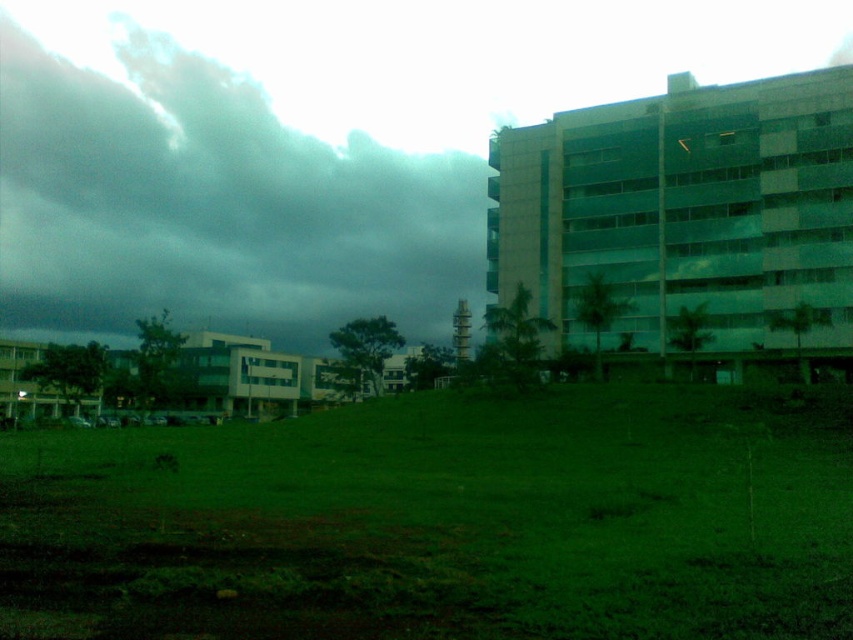
Can you confirm if green grassy field at lower center is smaller than dark gray cloud at upper left?

Yes.

Based on the photo, between green grassy field at lower center and dark gray cloud at upper left, which one appears on the left side from the viewer's perspective?

Positioned to the left is dark gray cloud at upper left.

I want to click on green grassy field at lower center, so click(444, 520).

You are a GUI agent. You are given a task and a screenshot of the screen. Output one action in this format:
    pyautogui.click(x=<x>, y=<y>)
    Task: Click on the green grassy field at lower center
    This screenshot has width=853, height=640.
    Given the screenshot: What is the action you would take?
    pyautogui.click(x=444, y=520)